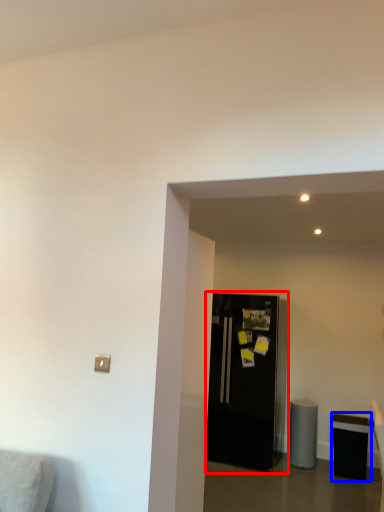
Question: Which of the following is the farthest to the observer, refrigerator (highlighted by a red box) or furniture (highlighted by a blue box)?

Choices:
 (A) refrigerator
 (B) furniture

Answer: (A)